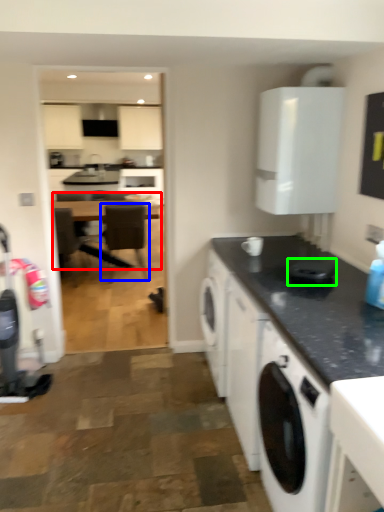
Question: Which is nearer to the table (highlighted by a red box)? chair (highlighted by a blue box) or appliance (highlighted by a green box).

Choices:
 (A) chair
 (B) appliance

Answer: (A)